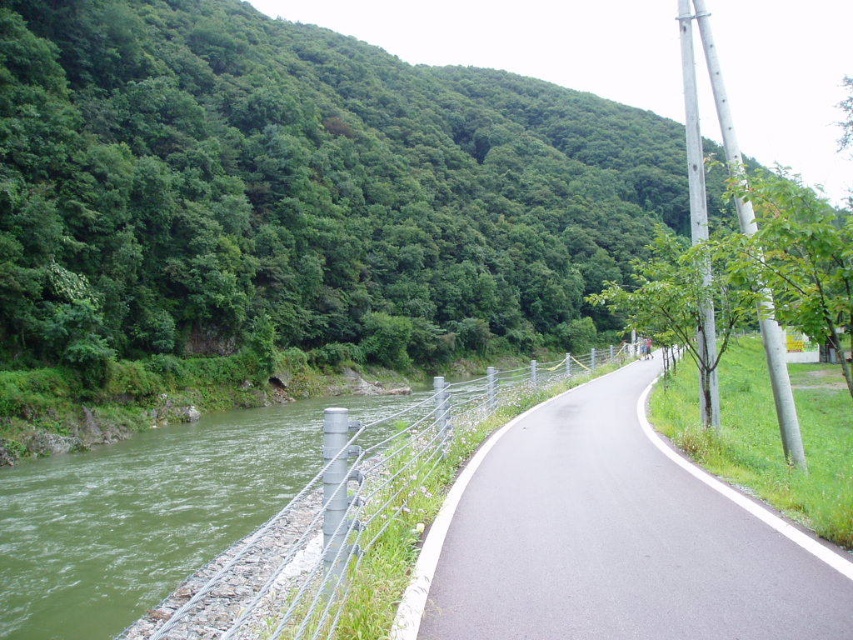
Does green leafy hillside at upper left appear under black asphalt road at center?

Incorrect, green leafy hillside at upper left is not positioned below black asphalt road at center.

Is point (300, 204) farther from viewer compared to point (807, 582)?

That is True.

Where is `green leafy hillside at upper left`? The image size is (853, 640). green leafy hillside at upper left is located at coordinates (299, 195).

Is green leafy hillside at upper left to the right of wire mesh fence at left from the viewer's perspective?

Indeed, green leafy hillside at upper left is positioned on the right side of wire mesh fence at left.

The width and height of the screenshot is (853, 640). I want to click on green leafy hillside at upper left, so click(299, 195).

Identify the location of green leafy hillside at upper left. (299, 195).

Between black asphalt road at center and wire mesh fence at left, which one is positioned lower?

wire mesh fence at left

Is point (599, 556) positioned after point (367, 492)?

No, it is in front of (367, 492).

This screenshot has width=853, height=640. In order to click on black asphalt road at center in this screenshot , I will do `click(618, 538)`.